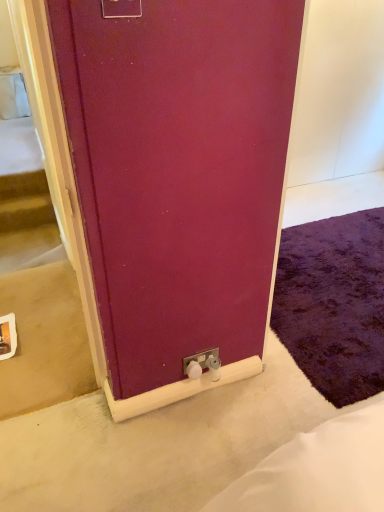
At what (x,y) coordinates should I click in order to perform the action: click on purple shaggy rug at lower right. Please return your answer as a coordinate pair (x, y). Looking at the image, I should click on (334, 303).

I want to click on white plastic electric outlet at lower center, the 1th electric outlet positioned from the bottom, so click(201, 358).

At what (x,y) coordinates should I click in order to perform the action: click on purple shaggy rug at lower right. Please return your answer as a coordinate pair (x, y). Looking at the image, I should click on coord(334,303).

Is white plastic electric outlet at lower center, the first electric outlet in the right-to-left sequence, looking in the opposite direction of matte plastic electric outlet at upper center, acting as the 2th electric outlet starting from the right?

white plastic electric outlet at lower center, the first electric outlet in the right-to-left sequence, is not turned away from matte plastic electric outlet at upper center, acting as the 2th electric outlet starting from the right.

From the image's perspective, who appears lower, white plastic electric outlet at lower center, which ranks as the 2th electric outlet in front-to-back order, or matte plastic electric outlet at upper center, the first electric outlet viewed from the front?

From the image's view, white plastic electric outlet at lower center, which ranks as the 2th electric outlet in front-to-back order, is below.

Which object is wider, white plastic electric outlet at lower center, placed as the 1th electric outlet when sorted from back to front, or matte plastic electric outlet at upper center, positioned as the second electric outlet in back-to-front order?

With larger width is matte plastic electric outlet at upper center, positioned as the second electric outlet in back-to-front order.

Between white plastic electric outlet at lower center, the first electric outlet in the right-to-left sequence, and matte plastic electric outlet at upper center, marked as the first electric outlet in a top-to-bottom arrangement, which one is positioned behind?

white plastic electric outlet at lower center, the first electric outlet in the right-to-left sequence, is further away from the camera.

Would you say white plastic electric outlet at lower center, the 1th electric outlet positioned from the bottom, is outside purple shaggy rug at lower right?

white plastic electric outlet at lower center, the 1th electric outlet positioned from the bottom, is positioned outside purple shaggy rug at lower right.

Considering the relative positions of white plastic electric outlet at lower center, which is the 2th electric outlet in left-to-right order, and purple shaggy rug at lower right in the image provided, is white plastic electric outlet at lower center, which is the 2th electric outlet in left-to-right order, to the right of purple shaggy rug at lower right from the viewer's perspective?

No, white plastic electric outlet at lower center, which is the 2th electric outlet in left-to-right order, is not to the right of purple shaggy rug at lower right.

Which object is thinner, white plastic electric outlet at lower center, the first electric outlet in the right-to-left sequence, or purple shaggy rug at lower right?

white plastic electric outlet at lower center, the first electric outlet in the right-to-left sequence.

Which object is further away from the camera, white plastic electric outlet at lower center, acting as the second electric outlet starting from the top, or purple shaggy rug at lower right?

purple shaggy rug at lower right is behind.

Looking at this image, which is behind, purple shaggy rug at lower right or matte plastic electric outlet at upper center, positioned as the second electric outlet in back-to-front order?

Positioned behind is purple shaggy rug at lower right.

Considering the sizes of objects purple shaggy rug at lower right and matte plastic electric outlet at upper center, the first electric outlet viewed from the front, in the image provided, who is wider, purple shaggy rug at lower right or matte plastic electric outlet at upper center, the first electric outlet viewed from the front,?

Wider between the two is purple shaggy rug at lower right.

Which object is positioned more to the left, purple shaggy rug at lower right or matte plastic electric outlet at upper center, acting as the 2th electric outlet starting from the right?

A: matte plastic electric outlet at upper center, acting as the 2th electric outlet starting from the right.

From a real-world perspective, which is physically below, purple shaggy rug at lower right or matte plastic electric outlet at upper center, marked as the first electric outlet in a top-to-bottom arrangement?

purple shaggy rug at lower right, from a real-world perspective.

Is matte plastic electric outlet at upper center, which appears as the first electric outlet when viewed from the left, completely or partially outside of white plastic electric outlet at lower center, acting as the second electric outlet starting from the top?

Yes, matte plastic electric outlet at upper center, which appears as the first electric outlet when viewed from the left, is outside of white plastic electric outlet at lower center, acting as the second electric outlet starting from the top.

Is matte plastic electric outlet at upper center, acting as the 2th electric outlet starting from the right, oriented towards white plastic electric outlet at lower center, the first electric outlet in the right-to-left sequence?

No, matte plastic electric outlet at upper center, acting as the 2th electric outlet starting from the right, is not aimed at white plastic electric outlet at lower center, the first electric outlet in the right-to-left sequence.

Is point (138, 15) closer to viewer compared to point (188, 360)?

Yes.

This screenshot has height=512, width=384. In order to click on the 2nd electric outlet in front when counting from the purple shaggy rug at lower right in this screenshot , I will do `click(121, 9)`.

From a real-world perspective, is matte plastic electric outlet at upper center, marked as the first electric outlet in a top-to-bottom arrangement, under purple shaggy rug at lower right?

Actually, matte plastic electric outlet at upper center, marked as the first electric outlet in a top-to-bottom arrangement, is physically above purple shaggy rug at lower right in the real world.

Is point (105, 17) farther from camera compared to point (322, 358)?

No, it is not.

Are purple shaggy rug at lower right and white plastic electric outlet at lower center, placed as the 1th electric outlet when sorted from back to front, far apart?

Actually, purple shaggy rug at lower right and white plastic electric outlet at lower center, placed as the 1th electric outlet when sorted from back to front, are a little close together.

Considering the relative positions of purple shaggy rug at lower right and white plastic electric outlet at lower center, the 1th electric outlet positioned from the bottom, in the image provided, is purple shaggy rug at lower right to the right of white plastic electric outlet at lower center, the 1th electric outlet positioned from the bottom, from the viewer's perspective?

Correct, you'll find purple shaggy rug at lower right to the right of white plastic electric outlet at lower center, the 1th electric outlet positioned from the bottom.

Does point (349, 391) appear closer or farther from the camera than point (206, 355)?

Clearly, point (349, 391) is more distant from the camera than point (206, 355).

The width and height of the screenshot is (384, 512). What are the coordinates of `electric outlet below the matte plastic electric outlet at upper center, the first electric outlet viewed from the front (from a real-world perspective)` in the screenshot? It's located at (201, 358).

Where is `electric outlet that is the 1st object located in front of the purple shaggy rug at lower right`? electric outlet that is the 1st object located in front of the purple shaggy rug at lower right is located at coordinates (201, 358).

Which object lies further to the anchor point purple shaggy rug at lower right, white plastic electric outlet at lower center, which ranks as the 2th electric outlet in front-to-back order, or matte plastic electric outlet at upper center, which appears as the first electric outlet when viewed from the left?

The object further to purple shaggy rug at lower right is matte plastic electric outlet at upper center, which appears as the first electric outlet when viewed from the left.

Estimate the real-world distances between objects in this image. Which object is further from matte plastic electric outlet at upper center, positioned as the second electric outlet in back-to-front order, purple shaggy rug at lower right or white plastic electric outlet at lower center, which ranks as the 2th electric outlet in front-to-back order?

purple shaggy rug at lower right.

When comparing their distances from matte plastic electric outlet at upper center, which appears as the first electric outlet when viewed from the left, does white plastic electric outlet at lower center, which is the 2th electric outlet in left-to-right order, or purple shaggy rug at lower right seem further?

purple shaggy rug at lower right lies further to matte plastic electric outlet at upper center, which appears as the first electric outlet when viewed from the left, than the other object.

Considering their positions, is matte plastic electric outlet at upper center, marked as the first electric outlet in a top-to-bottom arrangement, positioned further to white plastic electric outlet at lower center, which is the 2th electric outlet in left-to-right order, than purple shaggy rug at lower right?

The object further to white plastic electric outlet at lower center, which is the 2th electric outlet in left-to-right order, is matte plastic electric outlet at upper center, marked as the first electric outlet in a top-to-bottom arrangement.

Looking at the image, which one is located further to white plastic electric outlet at lower center, which ranks as the 2th electric outlet in front-to-back order, purple shaggy rug at lower right or matte plastic electric outlet at upper center, positioned as the second electric outlet in back-to-front order?

The object further to white plastic electric outlet at lower center, which ranks as the 2th electric outlet in front-to-back order, is matte plastic electric outlet at upper center, positioned as the second electric outlet in back-to-front order.

Estimate the real-world distances between objects in this image. Which object is closer to purple shaggy rug at lower right, matte plastic electric outlet at upper center, the second electric outlet in the bottom-to-top sequence, or white plastic electric outlet at lower center, placed as the 1th electric outlet when sorted from back to front?

white plastic electric outlet at lower center, placed as the 1th electric outlet when sorted from back to front, is closer to purple shaggy rug at lower right.

The image size is (384, 512). In order to click on electric outlet situated between matte plastic electric outlet at upper center, positioned as the second electric outlet in back-to-front order, and purple shaggy rug at lower right from left to right in this screenshot , I will do `click(201, 358)`.